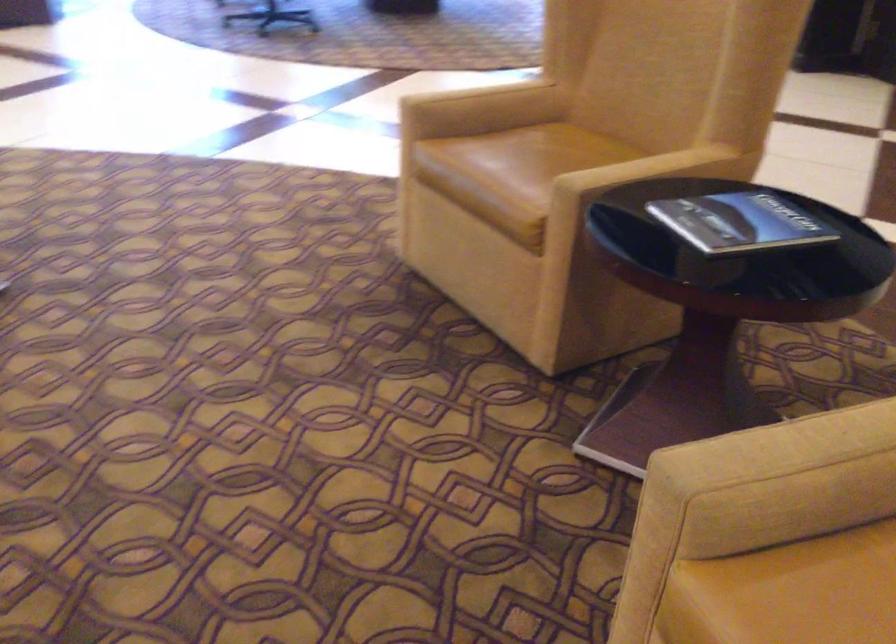
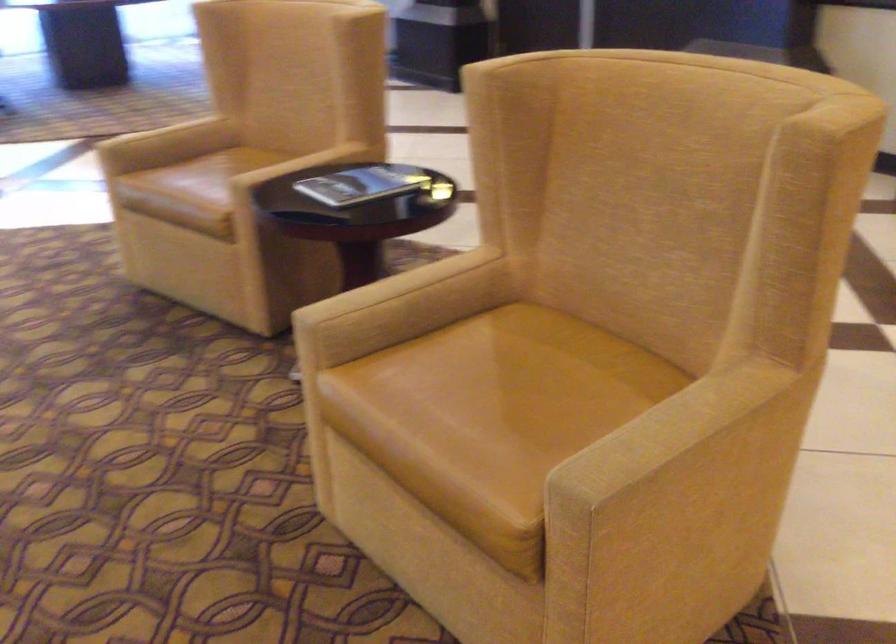
In the second image, find the point that corresponds to (501,99) in the first image.

(183, 129)